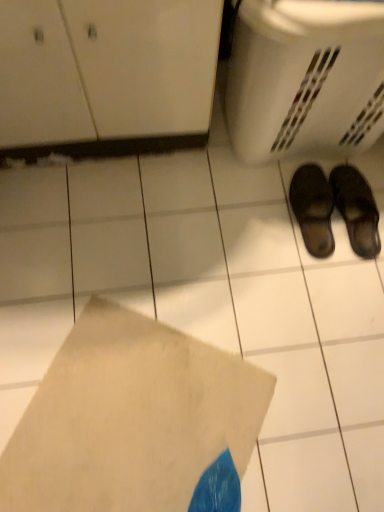
Question: Considering the positions of white plastic basket at lower right and black leather slippers at lower right, which is the 1th footwear from left to right, in the image, is white plastic basket at lower right taller or shorter than black leather slippers at lower right, which is the 1th footwear from left to right,?

Choices:
 (A) tall
 (B) short

Answer: (A)

Question: Is point (306, 60) positioned closer to the camera than point (317, 178)?

Choices:
 (A) closer
 (B) farther

Answer: (A)

Question: Estimate the real-world distances between objects in this image. Which object is closer to the black leather slippers at lower right, which ranks as the second footwear in right-to-left order?

Choices:
 (A) leather slipper at lower right, the second footwear when ordered from left to right
 (B) white matte envelope at lower center
 (C) white plastic basket at lower right

Answer: (A)

Question: Which object is positioned closest to the white matte envelope at lower center?

Choices:
 (A) leather slipper at lower right, the second footwear when ordered from left to right
 (B) white plastic basket at lower right
 (C) black leather slippers at lower right, which is the 1th footwear from left to right

Answer: (A)